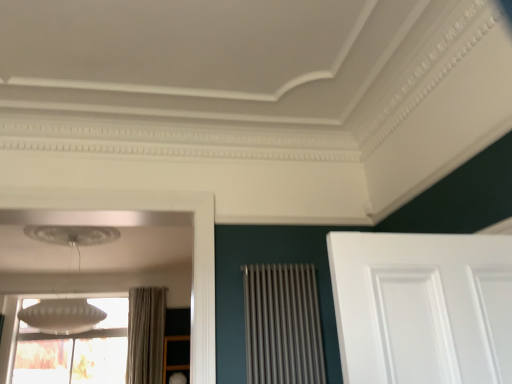
Question: From a real-world perspective, is matte gray curtain at left below white frosted glass lampshade at upper left?

Choices:
 (A) no
 (B) yes

Answer: (B)

Question: Would you say matte gray curtain at left is a long distance from white frosted glass lampshade at upper left?

Choices:
 (A) no
 (B) yes

Answer: (B)

Question: Is matte gray curtain at left touching white frosted glass lampshade at upper left?

Choices:
 (A) no
 (B) yes

Answer: (A)

Question: Does matte gray curtain at left lie behind white frosted glass lampshade at upper left?

Choices:
 (A) no
 (B) yes

Answer: (B)

Question: Considering the relative positions of matte gray curtain at left and white frosted glass lampshade at upper left in the image provided, is matte gray curtain at left to the right of white frosted glass lampshade at upper left from the viewer's perspective?

Choices:
 (A) no
 (B) yes

Answer: (B)

Question: Do you think white frosted glass lampshade at upper left is within metallic silver radiator at center, or outside of it?

Choices:
 (A) outside
 (B) inside

Answer: (A)

Question: Considering the positions of white frosted glass lampshade at upper left and metallic silver radiator at center in the image, is white frosted glass lampshade at upper left bigger or smaller than metallic silver radiator at center?

Choices:
 (A) big
 (B) small

Answer: (A)

Question: Is white frosted glass lampshade at upper left to the left or to the right of metallic silver radiator at center in the image?

Choices:
 (A) left
 (B) right

Answer: (A)

Question: From a real-world perspective, is white frosted glass lampshade at upper left physically located above or below metallic silver radiator at center?

Choices:
 (A) above
 (B) below

Answer: (A)

Question: Looking at the image, does wooden shelf at lower left seem bigger or smaller compared to matte gray curtain at left?

Choices:
 (A) small
 (B) big

Answer: (A)

Question: Is wooden shelf at lower left in front of or behind matte gray curtain at left in the image?

Choices:
 (A) front
 (B) behind

Answer: (B)

Question: From a real-world perspective, is wooden shelf at lower left physically located above or below matte gray curtain at left?

Choices:
 (A) below
 (B) above

Answer: (A)

Question: In the image, is wooden shelf at lower left on the left side or the right side of matte gray curtain at left?

Choices:
 (A) right
 (B) left

Answer: (A)

Question: Considering the positions of white frosted glass window at lower left and matte gray curtain at left in the image, is white frosted glass window at lower left bigger or smaller than matte gray curtain at left?

Choices:
 (A) big
 (B) small

Answer: (A)

Question: Does point (61, 354) appear closer or farther from the camera than point (137, 364)?

Choices:
 (A) closer
 (B) farther

Answer: (A)